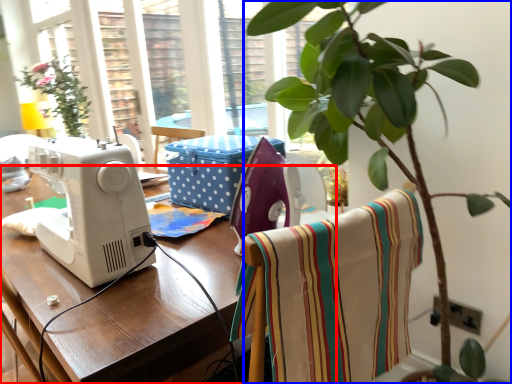
Question: Which point is further to the camera, table (highlighted by a red box) or houseplant (highlighted by a blue box)?

Choices:
 (A) table
 (B) houseplant

Answer: (A)